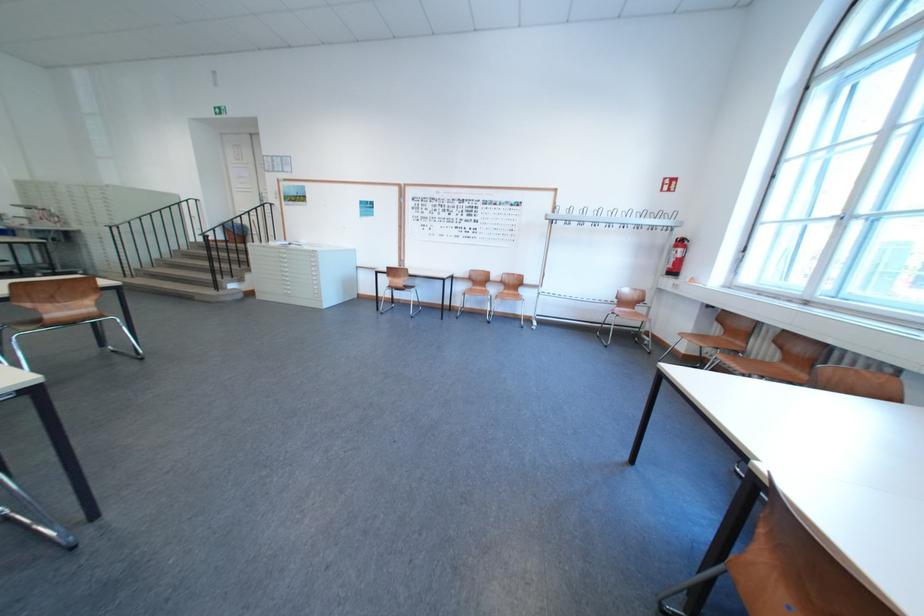
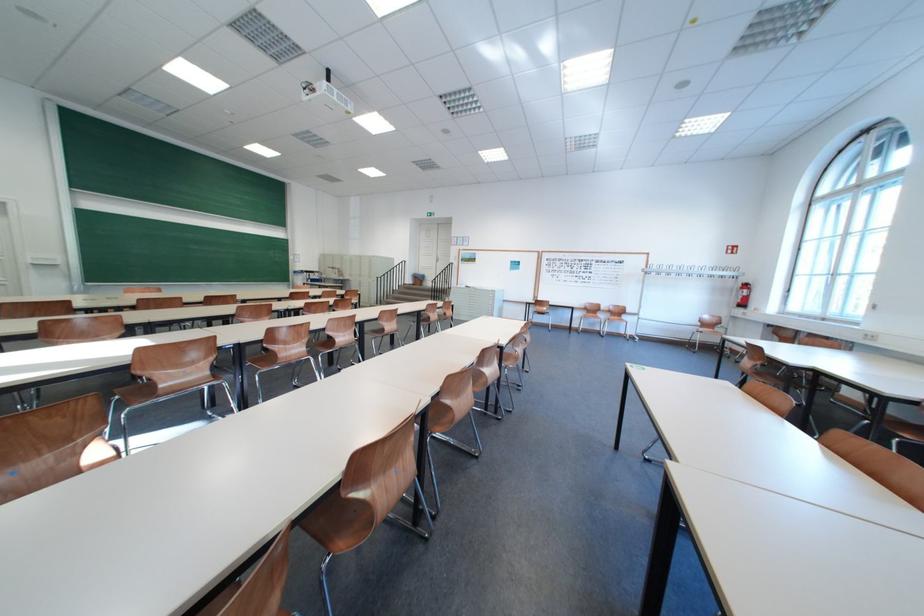
In a continuous first-person perspective shot, in which direction is the camera moving?

The cameraman moved toward left, backward.